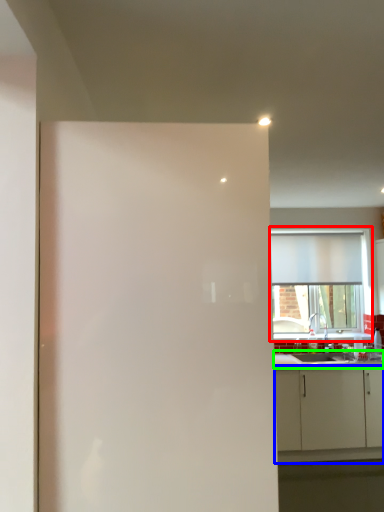
Question: Which object is the closest to the window (highlighted by a red box)? Choose among these: cabinetry (highlighted by a blue box) or countertop (highlighted by a green box).

Choices:
 (A) cabinetry
 (B) countertop

Answer: (B)